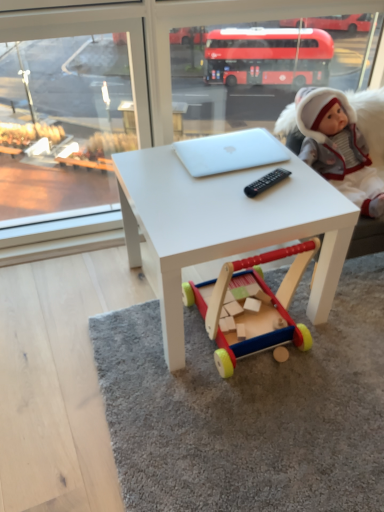
Find the location of a particular element. free location in front of white matte laptop at center is located at coordinates (227, 197).